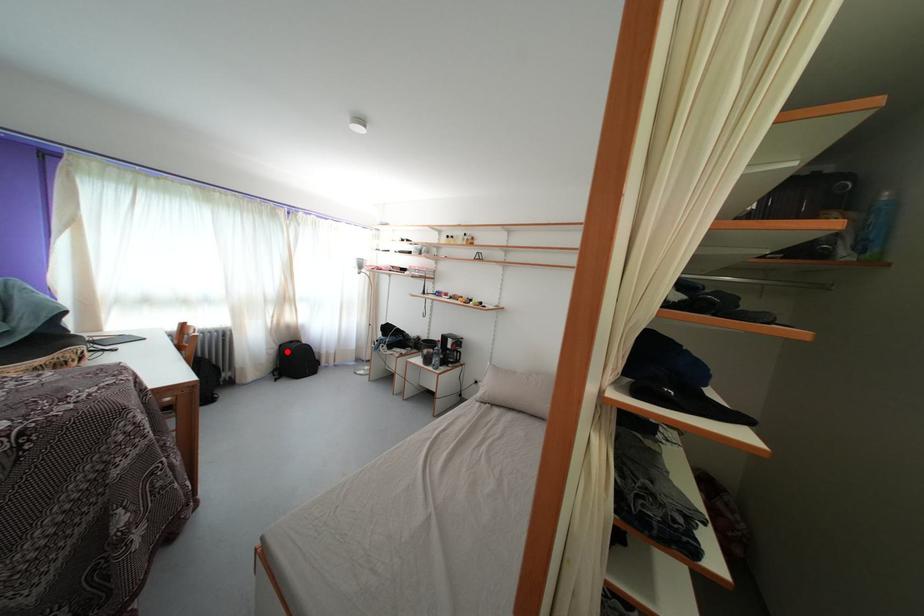
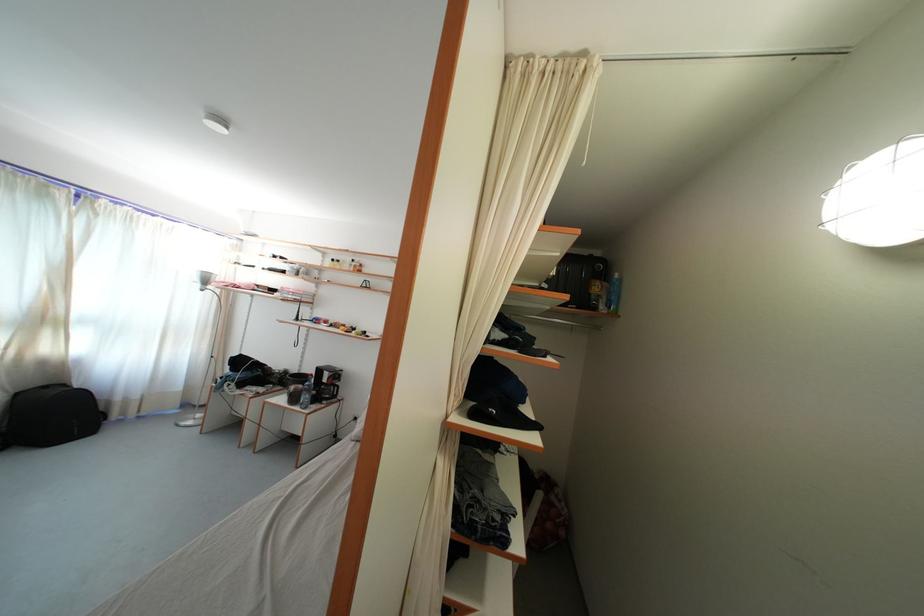
The point at the highlighted location is marked in the first image. Where is the corresponding point in the second image?

(23, 400)